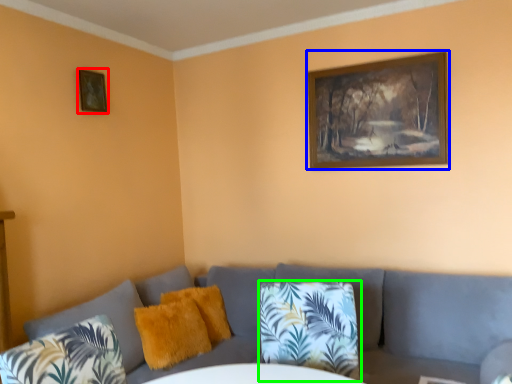
Question: Estimate the real-world distances between objects in this image. Which object is farther from picture frame (highlighted by a red box), picture frame (highlighted by a blue box) or pillow (highlighted by a green box)?

Choices:
 (A) picture frame
 (B) pillow

Answer: (B)